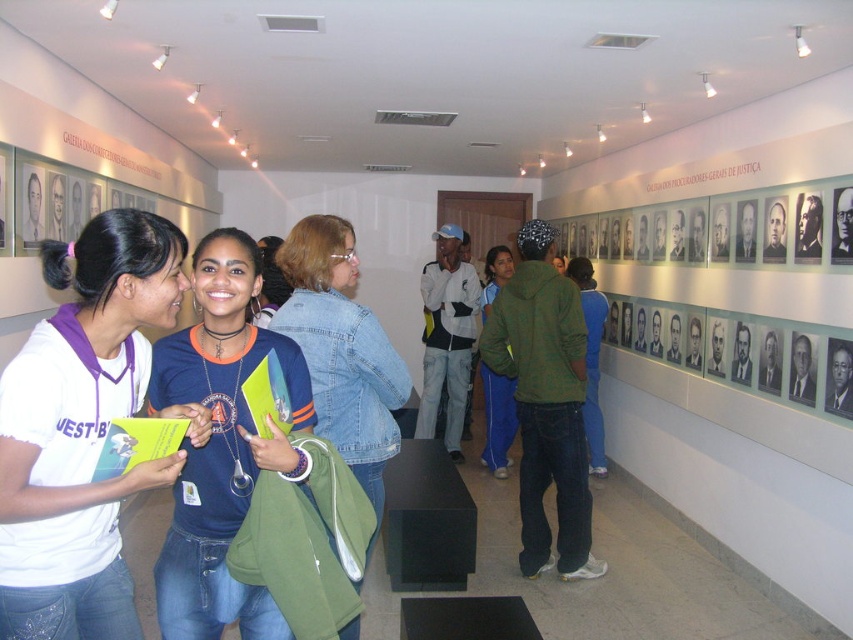
Please look at the scene. There is a point marked at coordinates (x=221, y=444). What object is located at this point?

The point at (x=221, y=444) marks the blue denim jacket at center.

You are an artist trying to paint the scene. You notice the denim jacket at center and the blue denim jeans at center. Which object should you paint first if you follow the rule of painting taller objects before shorter ones?

The denim jacket at center is much taller than the blue denim jeans at center, so you should paint the denim jacket at center first.